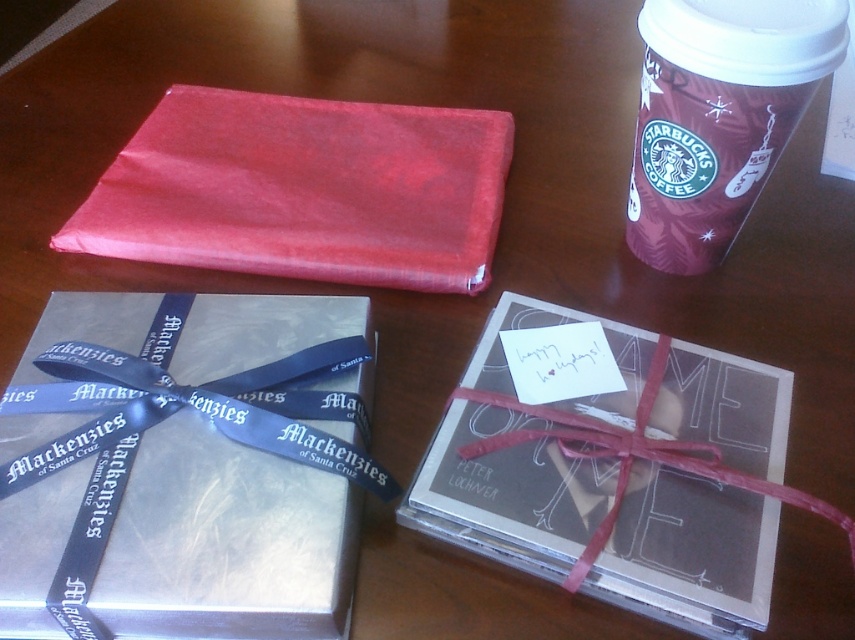
Is silver metallic gift at center positioned before shiny red fabric at upper left?

Yes, it is in front of shiny red fabric at upper left.

Between silver metallic gift at center and shiny red fabric at upper left, which one appears on the left side from the viewer's perspective?

silver metallic gift at center is more to the left.

Which is in front, point (234, 548) or point (417, 156)?

Point (234, 548) is in front.

This screenshot has height=640, width=855. I want to click on silver metallic gift at center, so click(x=181, y=541).

Is shiny red fabric at upper left thinner than maroon paper cup at upper right?

Incorrect, shiny red fabric at upper left's width is not less than maroon paper cup at upper right's.

Who is more distant from viewer, (255, 221) or (726, 26)?

Positioned behind is point (255, 221).

Between point (190, 241) and point (659, 131), which one is positioned in front?

Positioned in front is point (659, 131).

Locate an element on the screen. The height and width of the screenshot is (640, 855). shiny red fabric at upper left is located at coordinates (304, 189).

Which is more to the left, silver metallic gift at center or maroon paper cup at upper right?

silver metallic gift at center

At what (x,y) coordinates should I click in order to perform the action: click on silver metallic gift at center. Please return your answer as a coordinate pair (x, y). This screenshot has height=640, width=855. Looking at the image, I should click on (181, 541).

Where is `silver metallic gift at center`? The width and height of the screenshot is (855, 640). silver metallic gift at center is located at coordinates pyautogui.click(x=181, y=541).